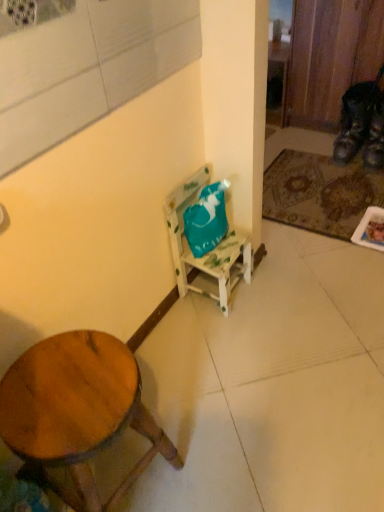
At what (x,y) coordinates should I click in order to perform the action: click on free spot below wooden stool at lower left (from a real-world perspective). Please return your answer as a coordinate pair (x, y). This screenshot has height=512, width=384. Looking at the image, I should click on (129, 480).